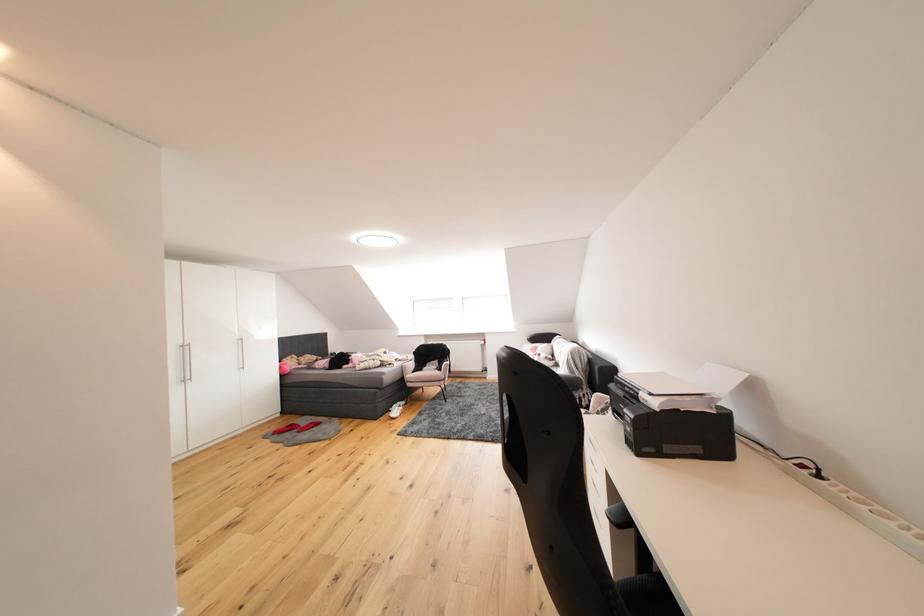
The height and width of the screenshot is (616, 924). I want to click on printer lid, so click(699, 390).